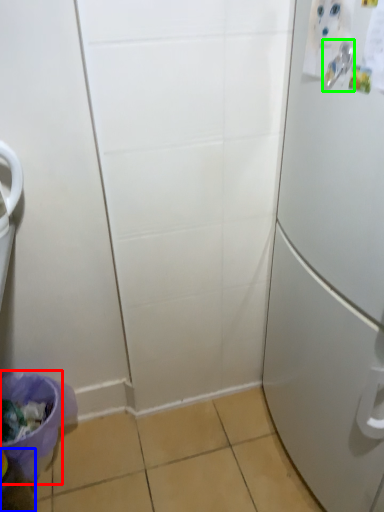
Question: Estimate the real-world distances between objects in this image. Which object is farther from potty (highlighted by a red box), bottle (highlighted by a blue box) or door handle (highlighted by a green box)?

Choices:
 (A) bottle
 (B) door handle

Answer: (B)